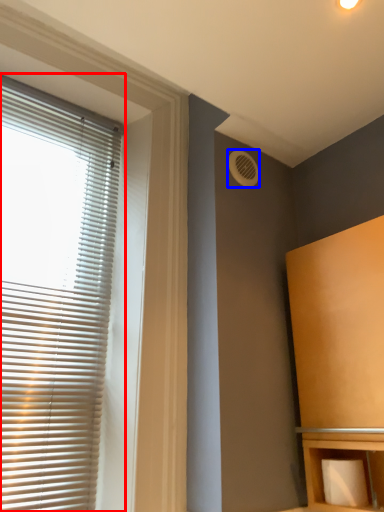
Question: Which object appears closest to the camera in this image, window blind (highlighted by a red box) or air conditioning (highlighted by a blue box)?

Choices:
 (A) window blind
 (B) air conditioning

Answer: (A)